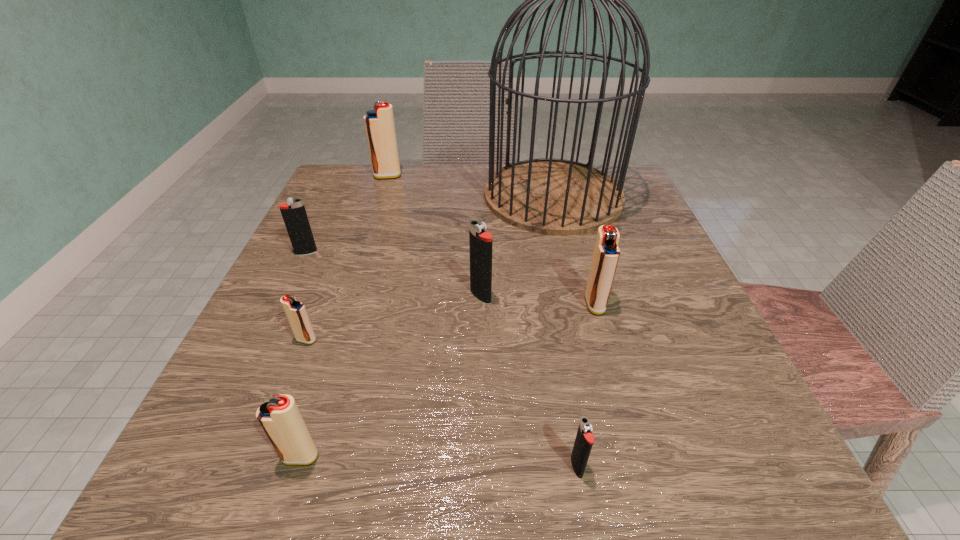
The height and width of the screenshot is (540, 960). What are the coordinates of `free space between the second farthest red igniter and the nearest red igniter` in the screenshot? It's located at (447, 380).

What are the coordinates of `vacant area that lies between the second farthest black igniter and the smallest red igniter` in the screenshot? It's located at (394, 318).

Identify the location of vacant area that lies between the nearest red igniter and the third nearest object. (303, 398).

Identify the location of free space that is in between the second farthest black igniter and the sixth igniter from left to right. (529, 381).

Locate an element on the screen. This screenshot has height=540, width=960. vacant space that is in between the fifth farthest igniter and the nearest red igniter is located at coordinates (303, 398).

This screenshot has height=540, width=960. Find the location of `blank region between the rightmost red igniter and the gray birdcage`. blank region between the rightmost red igniter and the gray birdcage is located at coordinates click(574, 250).

Where is `object that can be found as the third closest to the biggest black igniter`? object that can be found as the third closest to the biggest black igniter is located at coordinates coord(295,311).

Find the location of `the fifth closest object to the leftmost igniter`. the fifth closest object to the leftmost igniter is located at coordinates (280, 418).

Identify which igniter is the third nearest to the second biggest red igniter. Please provide its 2D coordinates. Your answer should be formatted as a tuple, i.e. [(x, y)], where the tuple contains the x and y coordinates of a point satisfying the conditions above.

[(295, 311)]

Locate which igniter ranks sixth in proximity to the nearest black igniter. Please provide its 2D coordinates. Your answer should be formatted as a tuple, i.e. [(x, y)], where the tuple contains the x and y coordinates of a point satisfying the conditions above.

[(379, 123)]